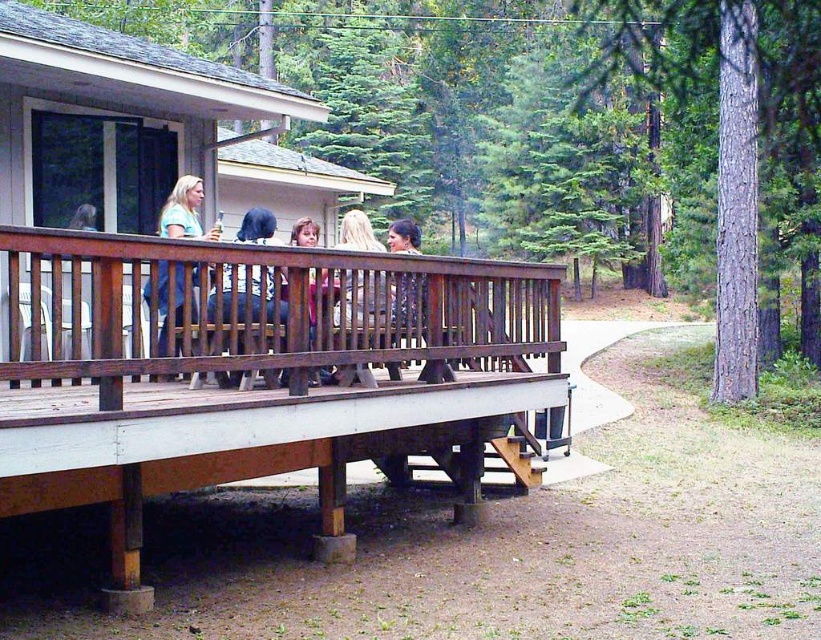
Does brown wood deck at center have a lesser width compared to wooden bench at center?

No, brown wood deck at center is not thinner than wooden bench at center.

Can you confirm if brown wood deck at center is smaller than wooden bench at center?

Incorrect, brown wood deck at center is not smaller in size than wooden bench at center.

Describe the element at coordinates (260, 378) in the screenshot. This screenshot has width=821, height=640. I see `brown wood deck at center` at that location.

Find the location of a particular element. brown wood deck at center is located at coordinates (260, 378).

Which is above, dark blue fabric at center or wooden bench at center?

Positioned higher is wooden bench at center.

Find the location of `dark blue fabric at center`. dark blue fabric at center is located at coordinates (258, 294).

Does matte blue shirt at upper center have a larger size compared to matte pink shirt at center?

Yes, matte blue shirt at upper center is bigger than matte pink shirt at center.

Does matte blue shirt at upper center have a lesser height compared to matte pink shirt at center?

In fact, matte blue shirt at upper center may be taller than matte pink shirt at center.

You are a GUI agent. You are given a task and a screenshot of the screen. Output one action in this format:
    pyautogui.click(x=<x>, y=<y>)
    Task: Click on the matte blue shirt at upper center
    The image size is (821, 640).
    Given the screenshot: What is the action you would take?
    pyautogui.click(x=184, y=211)